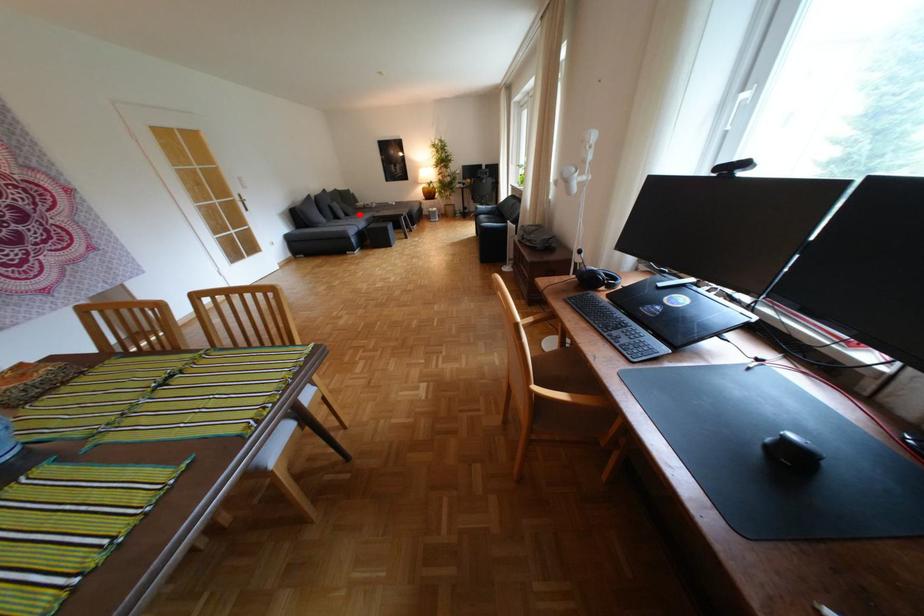
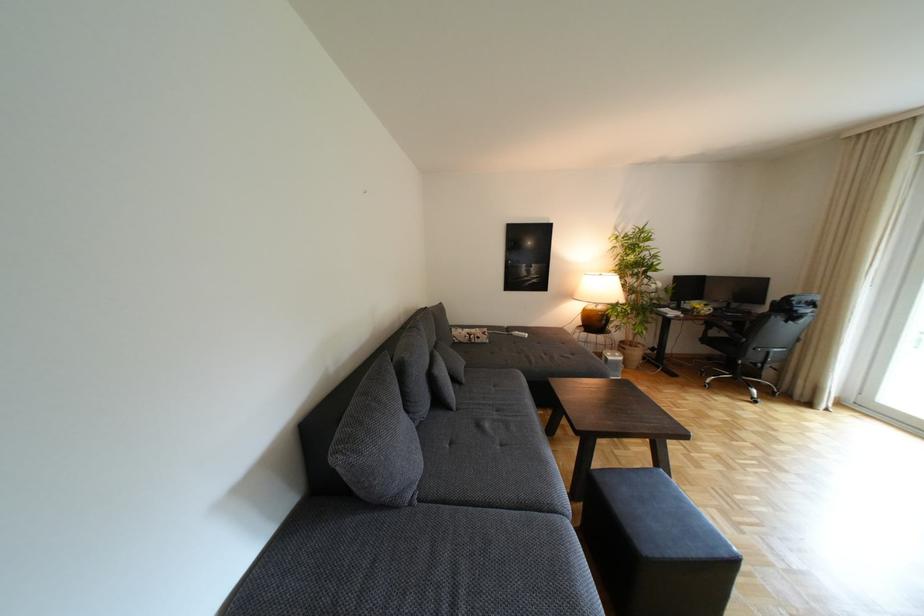
Question: A red point is marked in image1. In image2, is the corresponding 3D point closer to the camera or farther? Reply with the corresponding letter.

Choices:
 (A) The corresponding 3D point is closer.
 (B) The corresponding 3D point is farther.

Answer: (B)